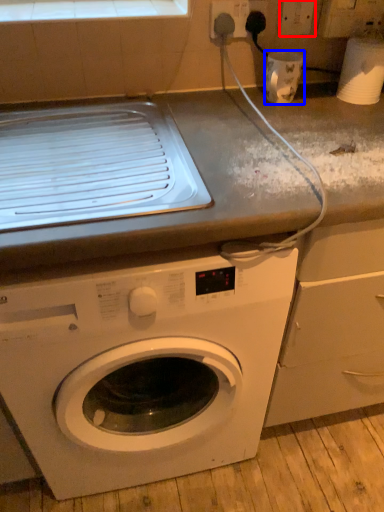
Question: Among these objects, which one is farthest to the camera, electric outlet (highlighted by a red box) or appliance (highlighted by a blue box)?

Choices:
 (A) electric outlet
 (B) appliance

Answer: (A)